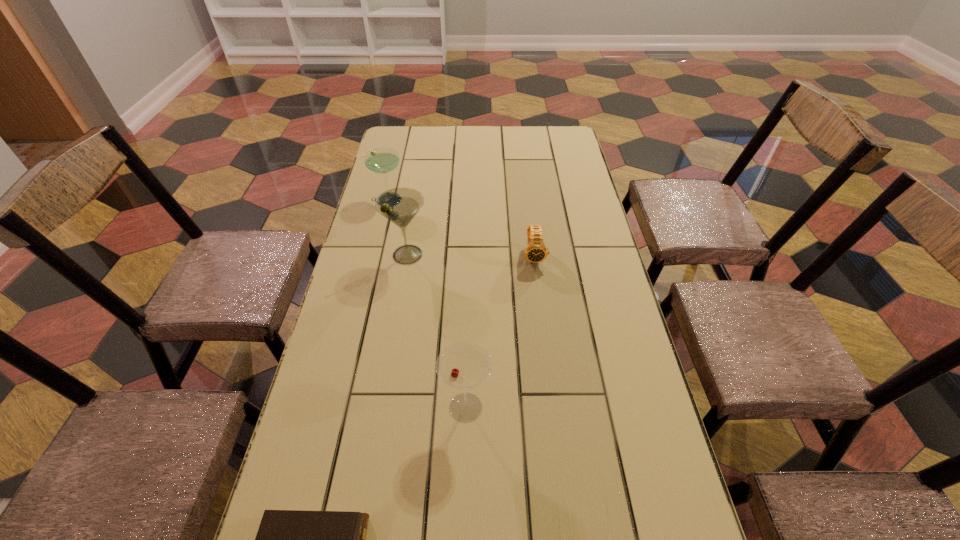
You are a GUI agent. You are given a task and a screenshot of the screen. Output one action in this format:
    pyautogui.click(x=<x>, y=<y>)
    Task: Click on the vacant area located on the face of the rightmost object
    
    Given the screenshot: What is the action you would take?
    pyautogui.click(x=541, y=320)

At what (x,y) coordinates should I click in order to perform the action: click on free location at the far edge of the desktop. Please return your answer as a coordinate pair (x, y). Image resolution: width=960 pixels, height=540 pixels. Looking at the image, I should click on (473, 140).

The image size is (960, 540). Identify the location of vacant area at the left edge. (324, 345).

At what (x,y) coordinates should I click in order to perform the action: click on vacant space at the right edge. Please return your answer as a coordinate pair (x, y). This screenshot has width=960, height=540. Looking at the image, I should click on (608, 327).

Locate an element on the screen. This screenshot has width=960, height=540. empty space that is in between the farthest martini and the fourth farthest object is located at coordinates (427, 303).

The height and width of the screenshot is (540, 960). In order to click on vacant area between the second nearest martini and the second nearest object in this screenshot , I will do `click(437, 331)`.

Find the location of a particular element. This screenshot has width=960, height=540. vacant area between the farthest martini and the second nearest martini is located at coordinates (397, 227).

Find the location of `free space between the tallest martini and the watch`. free space between the tallest martini and the watch is located at coordinates (470, 255).

At what (x,y) coordinates should I click in order to perform the action: click on vacant space that's between the tallest martini and the nearest martini. Please return your answer as a coordinate pair (x, y). This screenshot has width=960, height=540. Looking at the image, I should click on (437, 331).

In order to click on blank region between the farthest martini and the second farthest martini in this screenshot , I will do `click(397, 227)`.